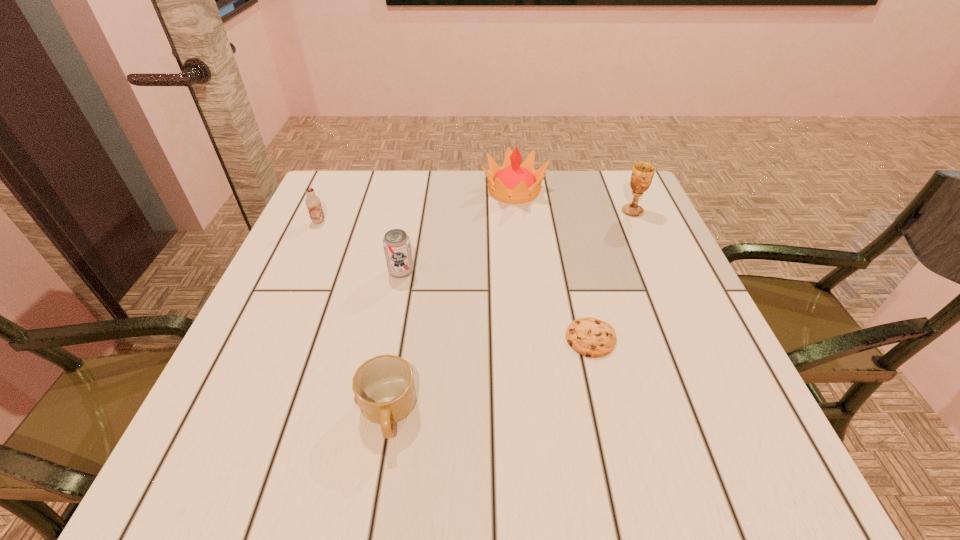
Find the location of a particular element. This screenshot has width=960, height=540. object that is at the far left corner is located at coordinates (313, 203).

The height and width of the screenshot is (540, 960). Identify the location of object located at the far right corner. (642, 174).

You are a GUI agent. You are given a task and a screenshot of the screen. Output one action in this format:
    pyautogui.click(x=<x>, y=<y>)
    Task: Click on the vacant space at the far edge of the desktop
    This screenshot has height=540, width=960.
    Given the screenshot: What is the action you would take?
    pyautogui.click(x=398, y=205)

Where is `vacant space at the left edge of the desktop`? vacant space at the left edge of the desktop is located at coordinates (258, 392).

Where is `free space at the right edge of the desktop`? Image resolution: width=960 pixels, height=540 pixels. free space at the right edge of the desktop is located at coordinates (652, 372).

You are a GUI agent. You are given a task and a screenshot of the screen. Output one action in this format:
    pyautogui.click(x=<x>, y=<y>)
    Task: Click on the free space at the far left corner of the desktop
    
    Given the screenshot: What is the action you would take?
    pyautogui.click(x=362, y=174)

Identify the location of vacant area at the far right corner of the desktop. The width and height of the screenshot is (960, 540). (602, 192).

Locate an element on the screen. This screenshot has height=540, width=960. vacant area between the mug and the third nearest object is located at coordinates (395, 342).

Where is `vacant region between the crown and the second nearest object`? This screenshot has height=540, width=960. vacant region between the crown and the second nearest object is located at coordinates (552, 264).

Find the location of a particular element. vacant area between the third farthest object and the mug is located at coordinates (353, 317).